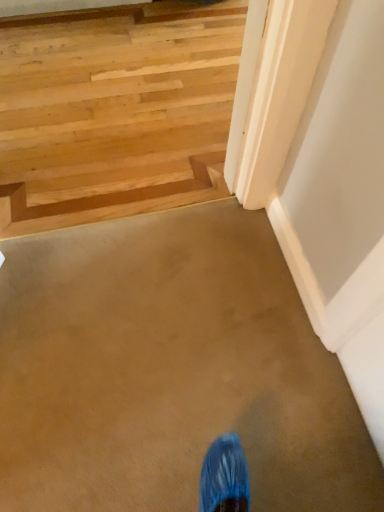
What do you see at coordinates (111, 200) in the screenshot? Image resolution: width=384 pixels, height=512 pixels. I see `light brown wood at upper left` at bounding box center [111, 200].

The image size is (384, 512). What are the coordinates of `light brown wood at upper left` in the screenshot? It's located at (111, 200).

Where is `natural wood stairs at upper left`? natural wood stairs at upper left is located at coordinates (114, 111).

The image size is (384, 512). What do you see at coordinates (114, 111) in the screenshot? I see `natural wood stairs at upper left` at bounding box center [114, 111].

Locate an element on the screen. Image resolution: width=384 pixels, height=512 pixels. light brown wood at upper left is located at coordinates (111, 200).

Looking at this image, considering the positions of objects natural wood stairs at upper left and light brown wood at upper left in the image provided, who is more to the left, natural wood stairs at upper left or light brown wood at upper left?

light brown wood at upper left is more to the left.

Considering their positions, is natural wood stairs at upper left located in front of or behind light brown wood at upper left?

In the image, natural wood stairs at upper left appears in front of light brown wood at upper left.

Which is closer, (126, 114) or (211, 172)?

The point (211, 172) is in front.

From the image's perspective, would you say natural wood stairs at upper left is shown under light brown wood at upper left?

No.

From a real-world perspective, which is physically below, natural wood stairs at upper left or light brown wood at upper left?

natural wood stairs at upper left, from a real-world perspective.

Which of these two, natural wood stairs at upper left or light brown wood at upper left, is wider?

With larger width is natural wood stairs at upper left.

Is natural wood stairs at upper left taller or shorter than light brown wood at upper left?

natural wood stairs at upper left is shorter than light brown wood at upper left.

Considering the sizes of objects natural wood stairs at upper left and light brown wood at upper left in the image provided, who is bigger, natural wood stairs at upper left or light brown wood at upper left?

natural wood stairs at upper left.

Is light brown wood at upper left located within natural wood stairs at upper left?

Yes, light brown wood at upper left is inside natural wood stairs at upper left.

Is natural wood stairs at upper left touching light brown wood at upper left?

natural wood stairs at upper left and light brown wood at upper left are clearly separated.

Looking at this image, is natural wood stairs at upper left facing away from light brown wood at upper left?

No, natural wood stairs at upper left is not facing away from light brown wood at upper left.

How distant is natural wood stairs at upper left from light brown wood at upper left?

natural wood stairs at upper left is 33.21 centimeters from light brown wood at upper left.

Locate an element on the screen. stairwell behind the natural wood stairs at upper left is located at coordinates (111, 200).

In the image, is light brown wood at upper left on the left side or the right side of natural wood stairs at upper left?

light brown wood at upper left is to the left of natural wood stairs at upper left.

Who is more distant, light brown wood at upper left or natural wood stairs at upper left?

light brown wood at upper left is further from the camera.

Is point (200, 190) farther from viewer compared to point (179, 56)?

No, (200, 190) is in front of (179, 56).

From the image's perspective, which is above, light brown wood at upper left or natural wood stairs at upper left?

natural wood stairs at upper left.

From a real-world perspective, is light brown wood at upper left below natural wood stairs at upper left?

Actually, light brown wood at upper left is physically above natural wood stairs at upper left in the real world.

In terms of width, does light brown wood at upper left look wider or thinner when compared to natural wood stairs at upper left?

Considering their sizes, light brown wood at upper left looks slimmer than natural wood stairs at upper left.

Which of these two, light brown wood at upper left or natural wood stairs at upper left, stands taller?

With more height is light brown wood at upper left.

Considering the sizes of objects light brown wood at upper left and natural wood stairs at upper left in the image provided, who is bigger, light brown wood at upper left or natural wood stairs at upper left?

With larger size is natural wood stairs at upper left.

Can natural wood stairs at upper left be found inside light brown wood at upper left?

No, natural wood stairs at upper left is located outside of light brown wood at upper left.

Is there a large distance between light brown wood at upper left and natural wood stairs at upper left?

They are positioned close to each other.

Is light brown wood at upper left oriented away from natural wood stairs at upper left?

Yes, light brown wood at upper left is facing away from natural wood stairs at upper left.

Can you tell me how much light brown wood at upper left and natural wood stairs at upper left differ in facing direction?

light brown wood at upper left and natural wood stairs at upper left are facing 180 degrees away from each other.

Measure the distance between light brown wood at upper left and natural wood stairs at upper left.

They are 33.21 centimeters apart.

Where is `stairs in front of the light brown wood at upper left`? The width and height of the screenshot is (384, 512). stairs in front of the light brown wood at upper left is located at coordinates (114, 111).

Identify the location of stairwell below the natural wood stairs at upper left (from the image's perspective). (111, 200).

Locate an element on the screen. The image size is (384, 512). stairwell behind the natural wood stairs at upper left is located at coordinates (111, 200).